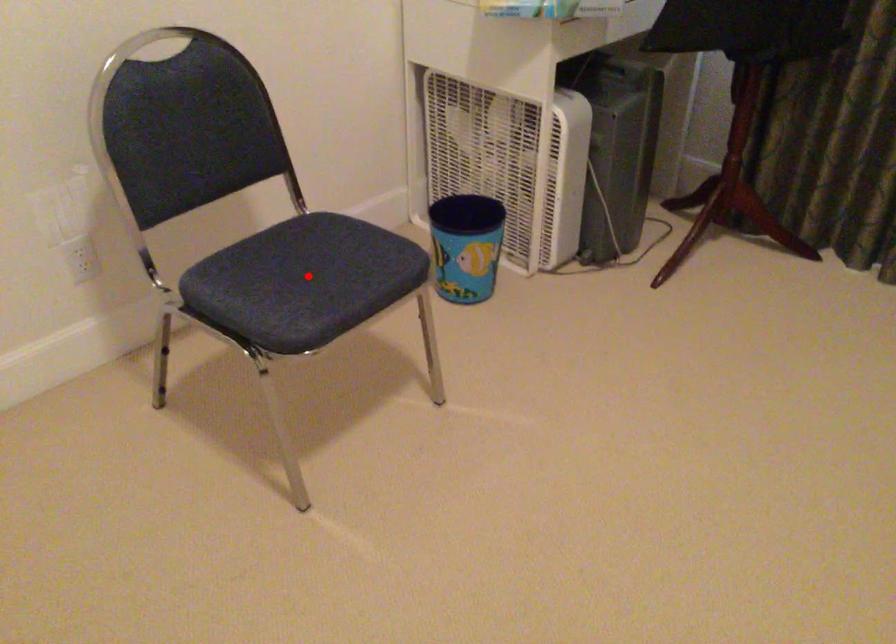
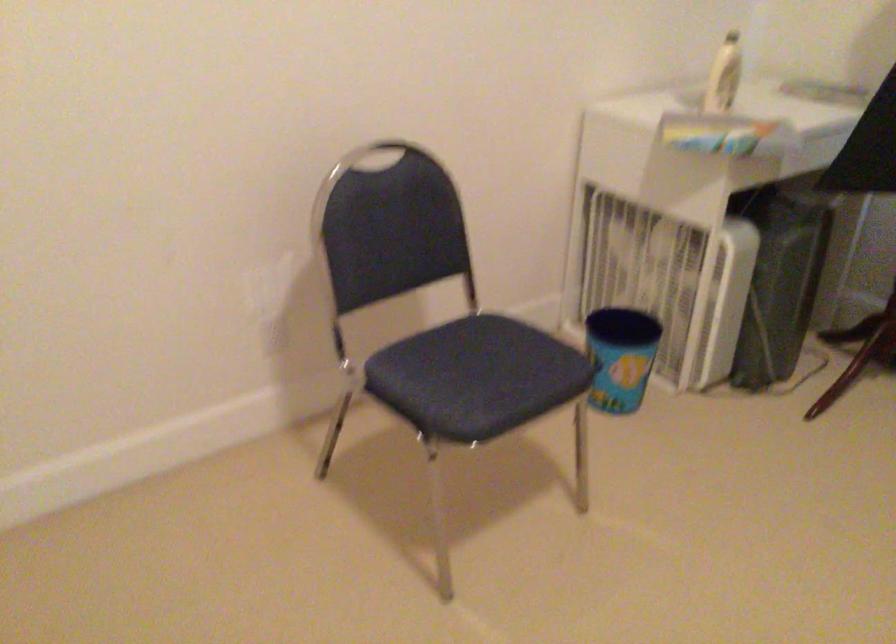
Locate, in the second image, the point that corresponds to the highlighted location in the first image.

(476, 377)